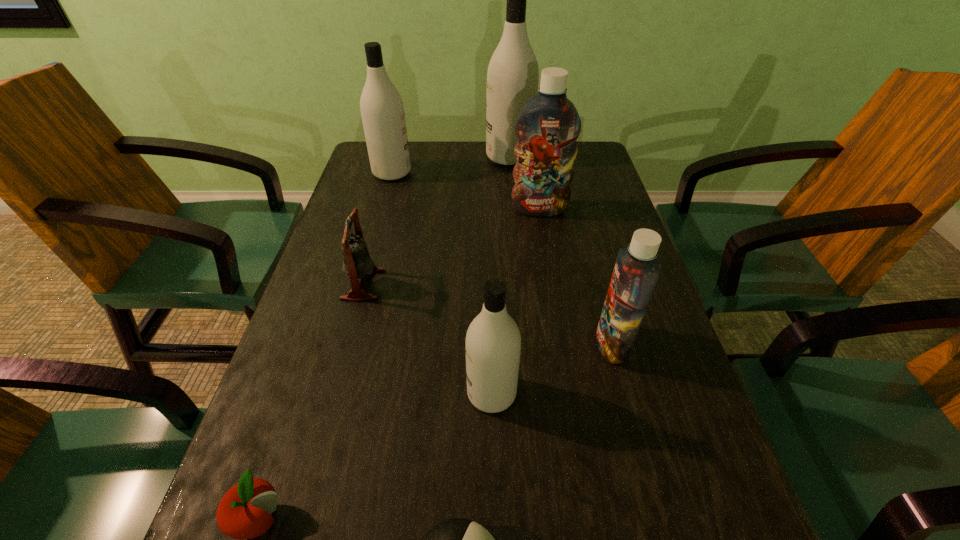
Find the location of a particular element. bell is located at coordinates click(x=357, y=264).

Locate an element on the screen. This screenshot has width=960, height=540. the fourth farthest object is located at coordinates [357, 264].

Where is `vacant space located on the front-facing side of the biggest white shampoo`? Image resolution: width=960 pixels, height=540 pixels. vacant space located on the front-facing side of the biggest white shampoo is located at coordinates pyautogui.click(x=435, y=157).

Where is `vacant position located on the front-facing side of the biggest white shampoo`? vacant position located on the front-facing side of the biggest white shampoo is located at coordinates (407, 157).

This screenshot has height=540, width=960. In order to click on vacant space situated 0.370m on the front-facing side of the biggest white shampoo in this screenshot , I will do `click(369, 157)`.

Image resolution: width=960 pixels, height=540 pixels. In order to click on free space located 0.180m on the front-facing side of the leftmost shampoo in this screenshot , I will do `click(471, 172)`.

Identify the location of free region located on the front label of the farther blue shampoo. This screenshot has width=960, height=540. (557, 312).

Find the location of a particular element. This screenshot has width=960, height=540. vacant area situated on the front label of the fourth farthest shampoo is located at coordinates (397, 344).

Locate an element on the screen. free point located on the front label of the fourth farthest shampoo is located at coordinates (540, 344).

You are a GUI agent. You are given a task and a screenshot of the screen. Output one action in this format:
    pyautogui.click(x=<x>, y=<y>)
    Task: Click on the free point located 0.390m on the front label of the fourth farthest shampoo
    This screenshot has width=960, height=540.
    Given the screenshot: What is the action you would take?
    397,344